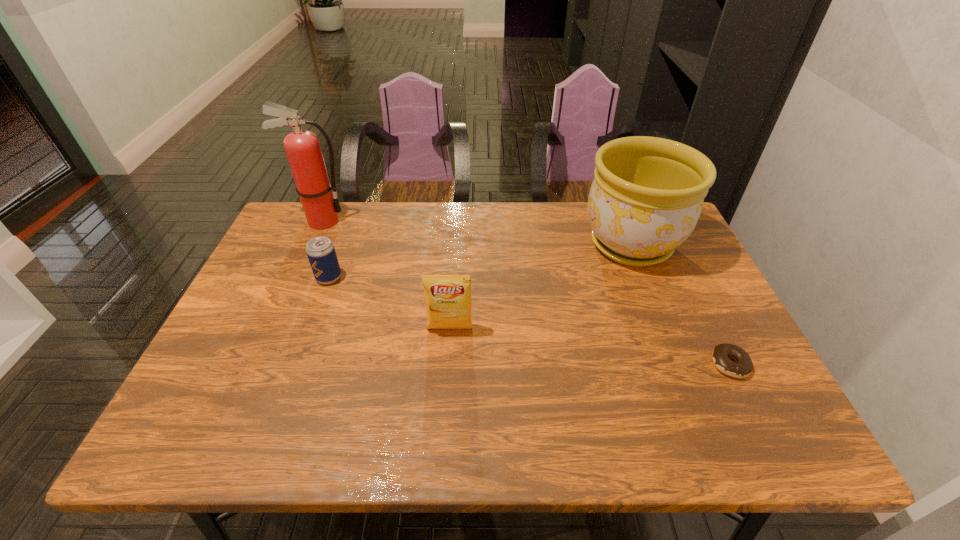
Image resolution: width=960 pixels, height=540 pixels. Identify the location of vacant space that satisfies the following two spatial constraints: 1. on the hose direction of the tallest object; 2. on the left side of the shortest object. (259, 364).

This screenshot has height=540, width=960. I want to click on free space that satisfies the following two spatial constraints: 1. on the back side of the flowerpot; 2. on the hose direction of the fire extinguisher, so click(x=621, y=221).

Where is `free spot that satisfies the following two spatial constraints: 1. on the front of the third tallest object with the logo; 2. on the right side of the shortest object`? The image size is (960, 540). free spot that satisfies the following two spatial constraints: 1. on the front of the third tallest object with the logo; 2. on the right side of the shortest object is located at coordinates (447, 364).

You are a GUI agent. You are given a task and a screenshot of the screen. Output one action in this format:
    pyautogui.click(x=<x>, y=<y>)
    Task: Click on the vacant space that satisfies the following two spatial constraints: 1. on the hose direction of the fourth shortest object; 2. on the right side of the fire extinguisher
    
    Given the screenshot: What is the action you would take?
    pyautogui.click(x=312, y=245)